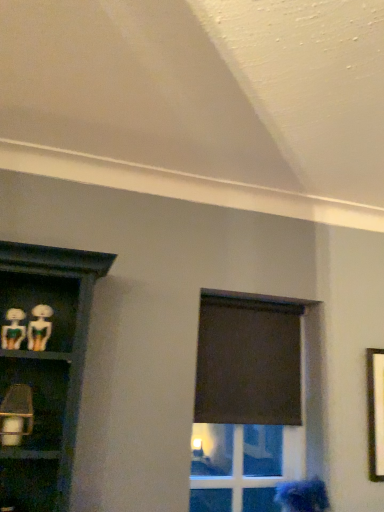
Question: Is black matte curtain at upper center a part of blue fabric at lower right, arranged as the third woman when viewed from the front?

Choices:
 (A) yes
 (B) no

Answer: (B)

Question: Is blue fabric at lower right, the 3th woman viewed from the top, behind black matte curtain at upper center?

Choices:
 (A) yes
 (B) no

Answer: (B)

Question: Is blue fabric at lower right, the 1th woman from the bottom, taller than black matte curtain at upper center?

Choices:
 (A) yes
 (B) no

Answer: (B)

Question: Does blue fabric at lower right, the 1th woman viewed from the right, lie in front of black matte curtain at upper center?

Choices:
 (A) yes
 (B) no

Answer: (A)

Question: Is there a large distance between blue fabric at lower right, the 1th woman viewed from the right, and black matte curtain at upper center?

Choices:
 (A) yes
 (B) no

Answer: (B)

Question: From the image's perspective, relative to matte green plastic skeleton at left, positioned as the second woman in left-to-right order, is black matte curtain at upper center above or below?

Choices:
 (A) above
 (B) below

Answer: (B)

Question: In the image, is black matte curtain at upper center on the left side or the right side of matte green plastic skeleton at left, the 2th woman positioned from the right?

Choices:
 (A) right
 (B) left

Answer: (A)

Question: Considering the positions of black matte curtain at upper center and matte green plastic skeleton at left, positioned as the second woman in left-to-right order, in the image, is black matte curtain at upper center wider or thinner than matte green plastic skeleton at left, positioned as the second woman in left-to-right order,?

Choices:
 (A) wide
 (B) thin

Answer: (B)

Question: From a real-world perspective, is black matte curtain at upper center physically located above or below matte green plastic skeleton at left, which ranks as the 2th woman in top-to-bottom order?

Choices:
 (A) below
 (B) above

Answer: (A)

Question: From a real-world perspective, is matte green plastic skeleton at left, the first woman viewed from the front, physically located above or below black matte curtain at upper center?

Choices:
 (A) above
 (B) below

Answer: (A)

Question: From the image's perspective, is matte green plastic skeleton at left, positioned as the 3th woman in back-to-front order, positioned above or below black matte curtain at upper center?

Choices:
 (A) above
 (B) below

Answer: (A)

Question: In terms of height, does matte green plastic skeleton at left, positioned as the 3th woman in back-to-front order, look taller or shorter compared to black matte curtain at upper center?

Choices:
 (A) short
 (B) tall

Answer: (A)

Question: Considering the positions of matte green plastic skeleton at left, which ranks as the 3th woman in right-to-left order, and black matte curtain at upper center in the image, is matte green plastic skeleton at left, which ranks as the 3th woman in right-to-left order, bigger or smaller than black matte curtain at upper center?

Choices:
 (A) small
 (B) big

Answer: (A)

Question: In terms of size, does matte green plastic skeleton at left, which ranks as the 2th woman in top-to-bottom order, appear bigger or smaller than transparent glass door at center?

Choices:
 (A) small
 (B) big

Answer: (A)

Question: From their relative heights in the image, would you say matte green plastic skeleton at left, which is the 2th woman in front-to-back order, is taller or shorter than transparent glass door at center?

Choices:
 (A) tall
 (B) short

Answer: (B)